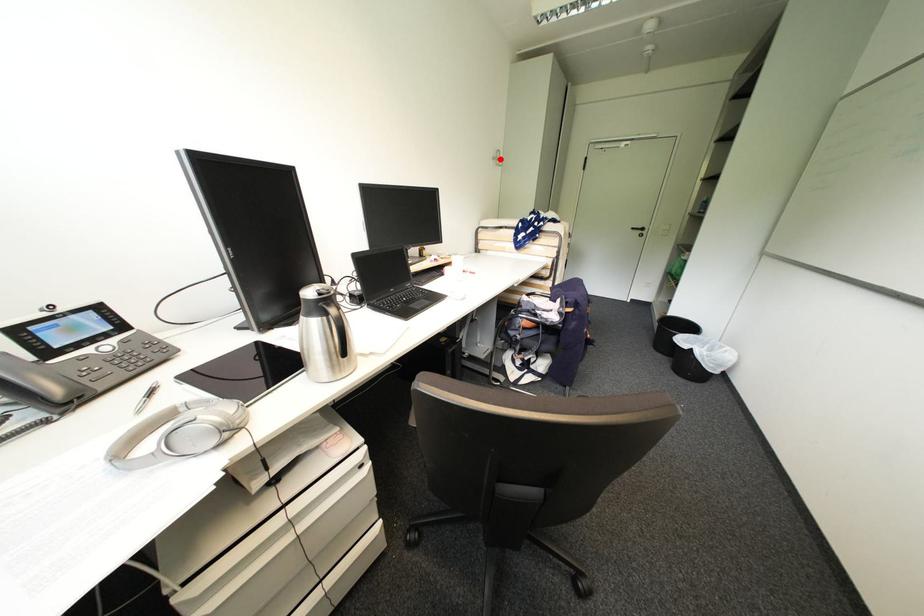
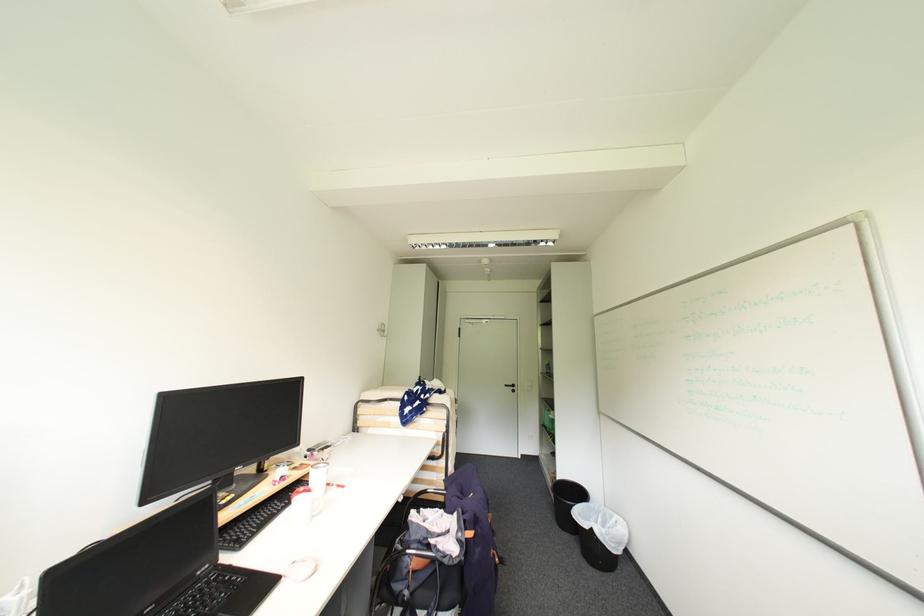
Locate, in the second image, the point that corresponds to the highlighted location in the first image.

(384, 331)